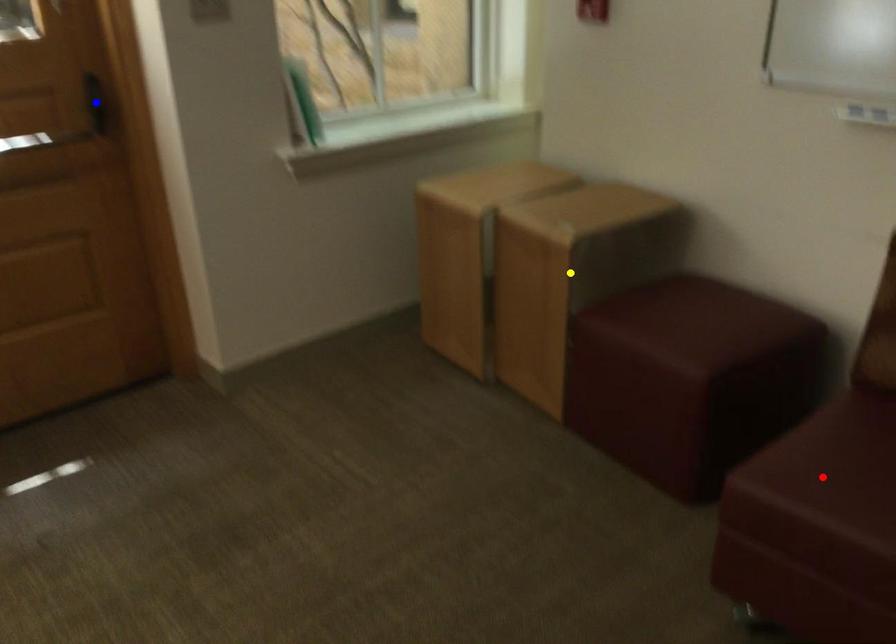
In the scene shown: Order these from nearest to farthest:
- blue point
- yellow point
- red point

yellow point
blue point
red point